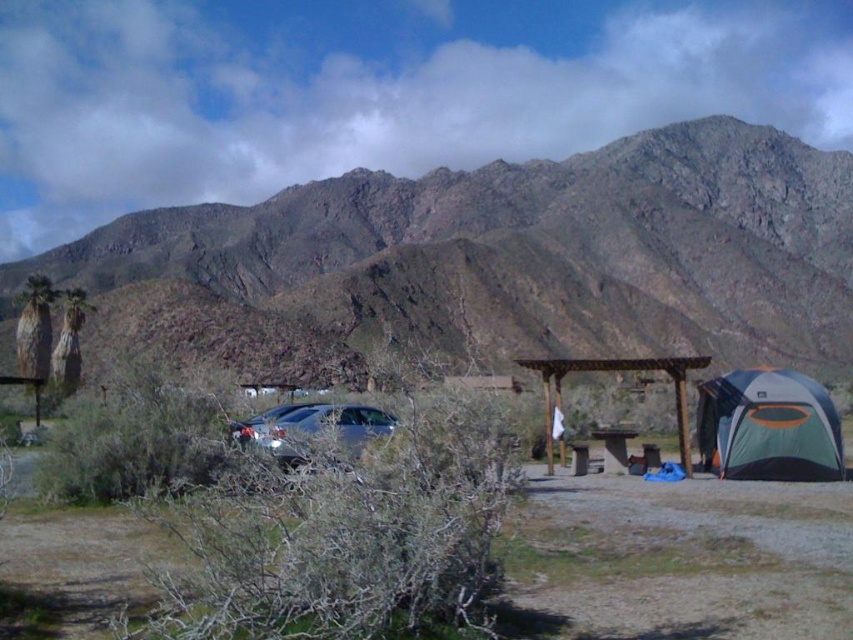
Which is below, green and gray fabric tent at lower right or wooden picnic table at center?

wooden picnic table at center is lower down.

Which of these two, green and gray fabric tent at lower right or wooden picnic table at center, stands taller?

With more height is green and gray fabric tent at lower right.

Identify the location of green and gray fabric tent at lower right. The image size is (853, 640). (769, 428).

Can you confirm if rugged rock mountain range at upper center is smaller than brown wooden gazebo at center?

Incorrect, rugged rock mountain range at upper center is not smaller in size than brown wooden gazebo at center.

Which is behind, point (155, 212) or point (646, 368)?

The point (155, 212) is behind.

Is point (738, 152) behind point (679, 372)?

Yes, point (738, 152) is behind point (679, 372).

This screenshot has width=853, height=640. In order to click on rugged rock mountain range at upper center in this screenshot , I will do `click(525, 252)`.

Is satin silver car at center behind brown wooden gazebo at center?

No, it is not.

Locate an element on the screen. satin silver car at center is located at coordinates (312, 428).